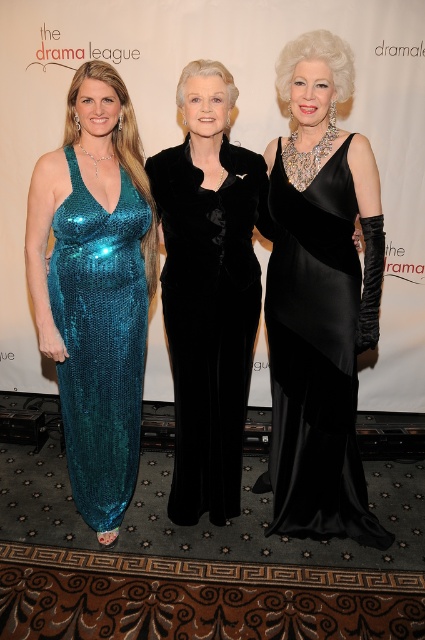
Question: Estimate the real-world distances between objects in this image. Which object is farther from the velvet black dress at center?

Choices:
 (A) satin black dress at center
 (B) teal sequined dress at center

Answer: (B)

Question: Does satin black dress at center appear under teal sequined dress at center?

Choices:
 (A) no
 (B) yes

Answer: (B)

Question: Does velvet black dress at center have a lesser width compared to teal sequined dress at center?

Choices:
 (A) no
 (B) yes

Answer: (A)

Question: Which of these objects is positioned closest to the satin black dress at center?

Choices:
 (A) velvet black dress at center
 (B) teal sequined dress at center

Answer: (A)

Question: Does velvet black dress at center lie behind teal sequined dress at center?

Choices:
 (A) no
 (B) yes

Answer: (A)

Question: Which of the following is the farthest from the observer?

Choices:
 (A) teal sequined dress at center
 (B) satin black dress at center
 (C) velvet black dress at center

Answer: (B)